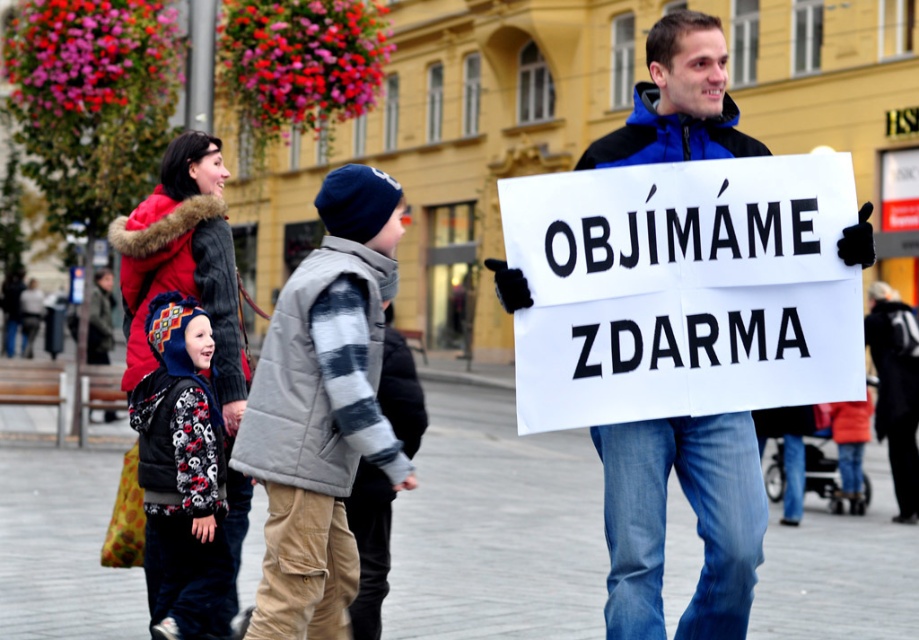
You are a photographer trying to capture the man holding the white paper sign at center and the blue fleece jacket at center in a single shot. Based on their positions, which object should you focus on first to ensure both are in frame?

The blue fleece jacket at center should be focused on first since the white paper sign at center is positioned to its right, allowing the photographer to frame both by starting with the jacket and adjusting to include the sign on the right side.

You are a tourist in this European city and want to take a photo with the man holding the large white sign. Where should you stand relative to the printed fleece jacket at center to ensure the sign is visible in your photo?

The printed fleece jacket at center is located at point (x=180, y=468), so you should position yourself behind or to the side of the printed fleece jacket at center to ensure the man and his sign are visible in your photo.

You are a fashion designer observing the two jackets in the scene. Which jacket, the gray quilted vest at center or the printed fleece jacket at center, is narrower?

The gray quilted vest at center has a lesser width compared to the printed fleece jacket at center, so the gray quilted vest at center is narrower.